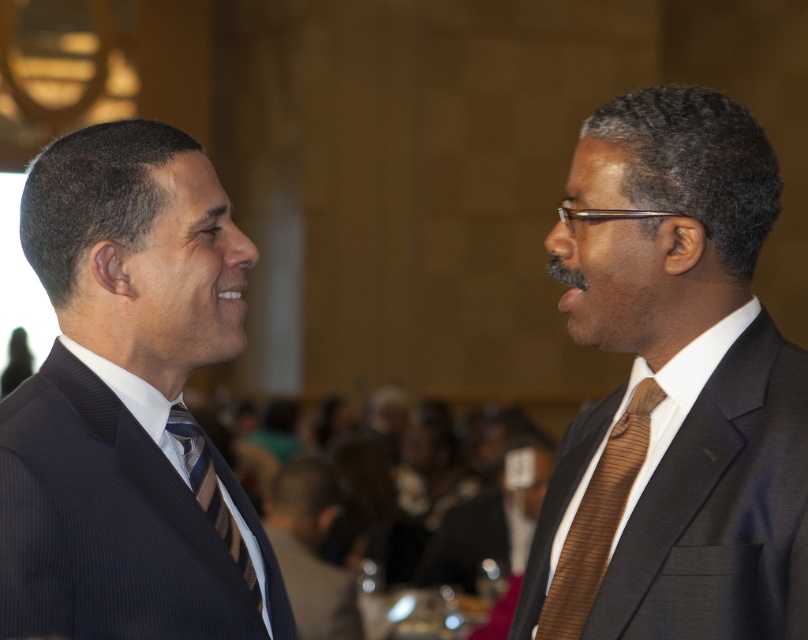
Question: Is brown striped tie at right closer to camera compared to brown silk tie at center?

Choices:
 (A) no
 (B) yes

Answer: (B)

Question: Which object is farther from the camera taking this photo?

Choices:
 (A) brown textured suit at center
 (B) brown silk tie at center
 (C) brown textured tie at right

Answer: (B)

Question: Can you confirm if dark blue suit at left is thinner than brown textured suit at center?

Choices:
 (A) no
 (B) yes

Answer: (A)

Question: Among these objects, which one is nearest to the camera?

Choices:
 (A) brown striped tie at right
 (B) dark blue suit at left
 (C) brown textured tie at right
 (D) striped fabric tie at left

Answer: (C)

Question: Is brown textured tie at right wider than brown silk tie at center?

Choices:
 (A) yes
 (B) no

Answer: (B)

Question: Which of the following is the closest to the observer?

Choices:
 (A) (682, 534)
 (B) (537, 621)

Answer: (A)